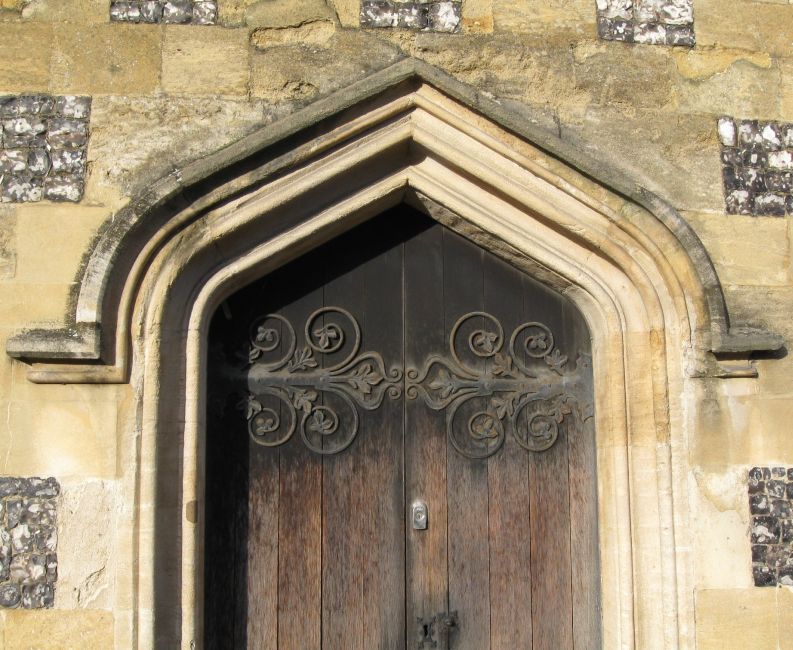
Where is `sloped left side top of door`? Image resolution: width=793 pixels, height=650 pixels. sloped left side top of door is located at coordinates (315, 248).